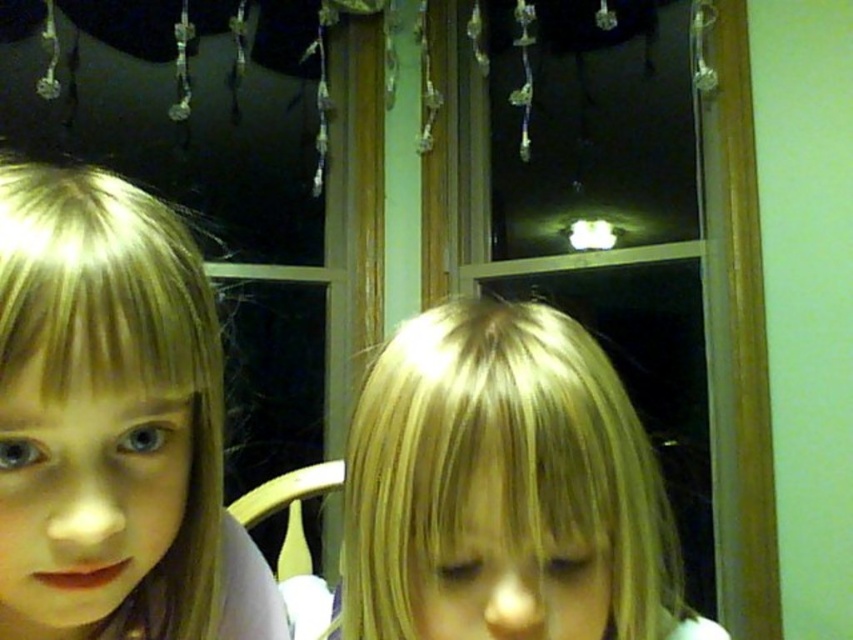
Question: Is blonde hair at left positioned before blonde hair at center?

Choices:
 (A) no
 (B) yes

Answer: (B)

Question: Which of the following is the farthest from the observer?

Choices:
 (A) tap(149, 234)
 (B) tap(444, 396)

Answer: (A)

Question: Can you confirm if blonde hair at left is positioned to the right of blonde hair at center?

Choices:
 (A) no
 (B) yes

Answer: (A)

Question: Is blonde hair at left smaller than blonde hair at center?

Choices:
 (A) no
 (B) yes

Answer: (B)

Question: Which point is farther to the camera?

Choices:
 (A) blonde hair at left
 (B) blonde hair at center

Answer: (B)